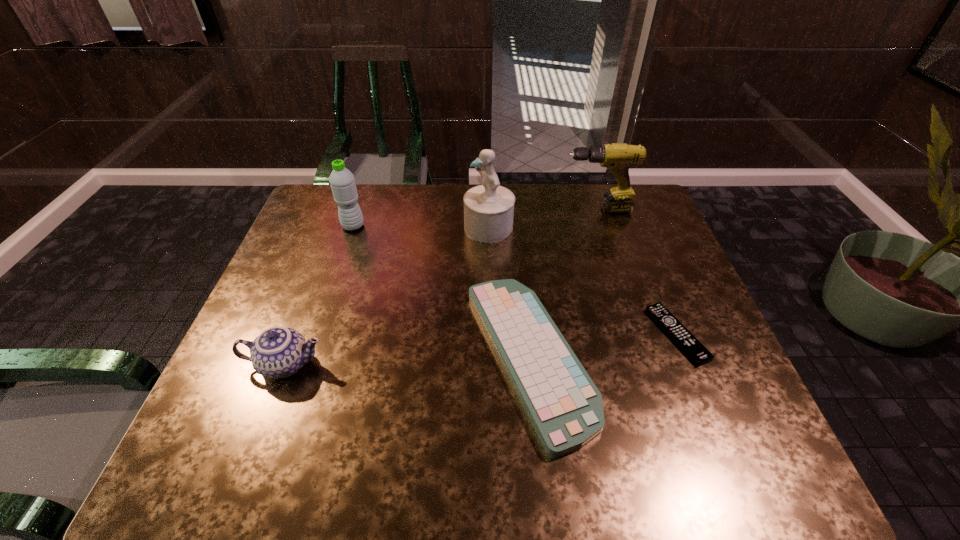
Where is `vacant area in the image that satisfies the following two spatial constraints: 1. on the back side of the remote control; 2. on the handle side of the drill`? The image size is (960, 540). vacant area in the image that satisfies the following two spatial constraints: 1. on the back side of the remote control; 2. on the handle side of the drill is located at coordinates (626, 210).

Where is `vacant space that satisfies the following two spatial constraints: 1. at the beak of the figurine; 2. on the right side of the shortest object`? This screenshot has height=540, width=960. vacant space that satisfies the following two spatial constraints: 1. at the beak of the figurine; 2. on the right side of the shortest object is located at coordinates (492, 335).